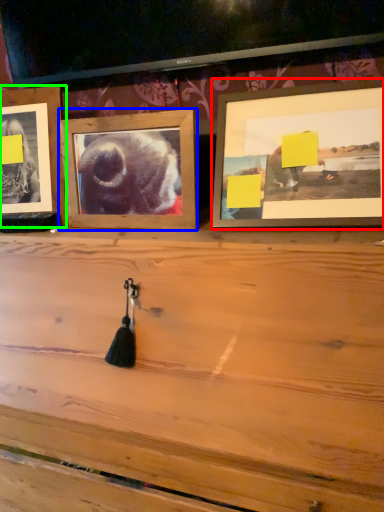
Question: Based on their relative distances, which object is farther from picture frame (highlighted by a red box)? Choose from picture frame (highlighted by a blue box) and picture frame (highlighted by a green box).

Choices:
 (A) picture frame
 (B) picture frame

Answer: (B)